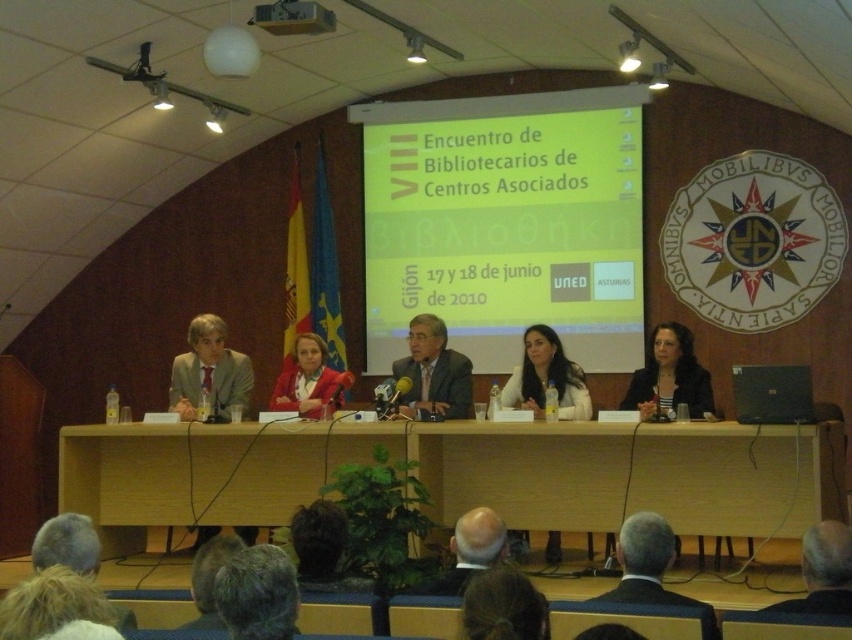
You are a photographer at the event and want to ensure all participants are visible in the photo. Considering the dark brown hair at lower center and the matte red blazer at center, which one is closer to the camera?

The dark brown hair at lower center is smaller than the matte red blazer at center, so it is farther away from the camera.